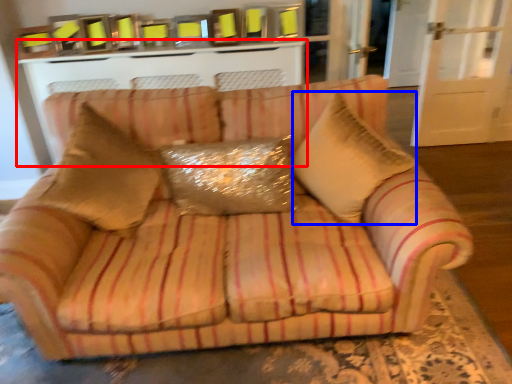
Question: Which object appears closest to the camera in this image, table (highlighted by a red box) or throw pillow (highlighted by a blue box)?

Choices:
 (A) table
 (B) throw pillow

Answer: (B)